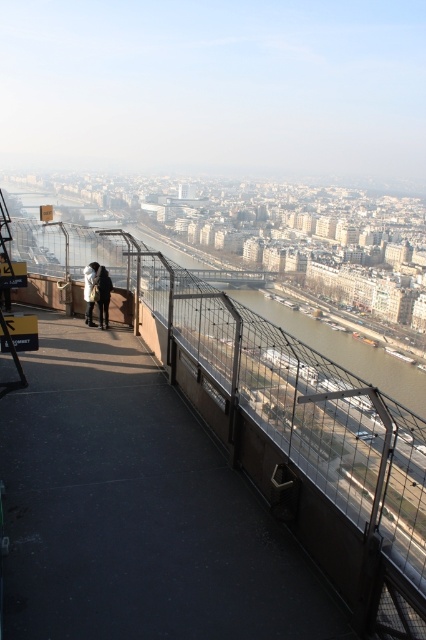
Question: Is black rubber path at center to the left of dark gray jacket at center from the viewer's perspective?

Choices:
 (A) yes
 (B) no

Answer: (B)

Question: Considering the relative positions of black rubber path at center and black leather jacket at upper left in the image provided, where is black rubber path at center located with respect to black leather jacket at upper left?

Choices:
 (A) below
 (B) above

Answer: (A)

Question: Estimate the real-world distances between objects in this image. Which object is farther from the dark gray jacket at center?

Choices:
 (A) black rubber path at center
 (B) black leather jacket at upper left

Answer: (A)

Question: Is black rubber path at center positioned at the back of black leather jacket at upper left?

Choices:
 (A) yes
 (B) no

Answer: (B)

Question: Which object is the farthest from the black rubber path at center?

Choices:
 (A) dark gray jacket at center
 (B) black leather jacket at upper left

Answer: (B)

Question: Among these objects, which one is nearest to the camera?

Choices:
 (A) black rubber path at center
 (B) dark gray jacket at center

Answer: (A)